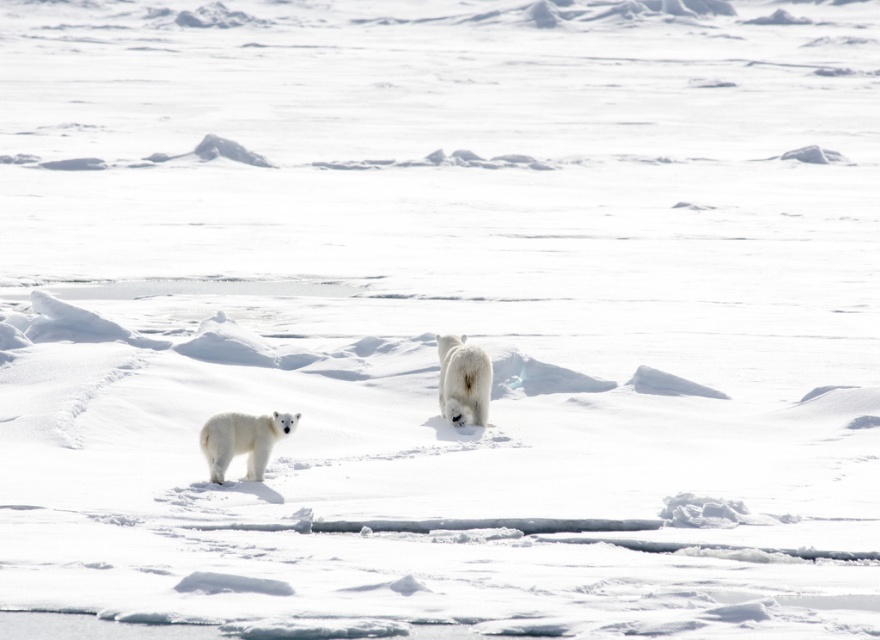
You are a wildlife photographer trying to capture a photo of both the white fluffy bear cub at lower left and the white fluffy bear at center in the same frame. Given that your camera has a maximum focus range of 10 feet, can you include both bears in the photo without moving your position?

The distance between the white fluffy bear cub at lower left and the white fluffy bear at center is 8.73 feet, which is within the camera maximum focus range of 10 feet. Therefore, you can include both bears in the photo without moving your position.

You are a wildlife photographer trying to capture both bears in a single frame. The camera you have can only focus on objects within a 1.5 meter width. Given that the white fluffy bear cub at lower left is wider than the white fluffy bear at center, which bear should you prioritize to ensure it fits within the camera frame?

Since the white fluffy bear cub at lower left is wider than the white fluffy bear at center, you should prioritize capturing the white fluffy bear cub at lower left to ensure it fits within the camera frame.

You are a wildlife photographer trying to capture a clear photo of both bears. Since the white fluffy bear cub at lower left is blocking your view of the white fluffy bear at center, can you move to the right to get a better shot? Explain your reasoning based on their positions.

The white fluffy bear cub at lower left is in front of the white fluffy bear at center. Moving to the right might allow you to see around the cub to get a clearer view of the white fluffy bear at center, as the cub is blocking the direct line of sight.